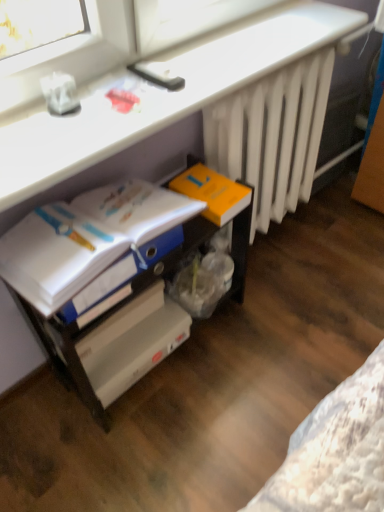
Question: Can you confirm if orange matte paperback book at center-right is shorter than blue glossy folder at lower left?

Choices:
 (A) yes
 (B) no

Answer: (A)

Question: Is orange matte paperback book at center-right behind blue glossy folder at lower left?

Choices:
 (A) yes
 (B) no

Answer: (A)

Question: Is orange matte paperback book at center-right not inside blue glossy folder at lower left?

Choices:
 (A) yes
 (B) no

Answer: (A)

Question: From the image's perspective, is orange matte paperback book at center-right above blue glossy folder at lower left?

Choices:
 (A) yes
 (B) no

Answer: (A)

Question: From the image's perspective, is orange matte paperback book at center-right beneath blue glossy folder at lower left?

Choices:
 (A) no
 (B) yes

Answer: (A)

Question: Looking at their shapes, would you say blue glossy folder at lower left is wider or thinner than white plastic computer at lower left?

Choices:
 (A) thin
 (B) wide

Answer: (A)

Question: In terms of size, does blue glossy folder at lower left appear bigger or smaller than white plastic computer at lower left?

Choices:
 (A) big
 (B) small

Answer: (B)

Question: Is blue glossy folder at lower left spatially inside white plastic computer at lower left, or outside of it?

Choices:
 (A) inside
 (B) outside

Answer: (B)

Question: From their relative heights in the image, would you say blue glossy folder at lower left is taller or shorter than white plastic computer at lower left?

Choices:
 (A) short
 (B) tall

Answer: (B)

Question: In terms of size, does white plastic computer at lower left appear bigger or smaller than blue glossy folder at lower left?

Choices:
 (A) big
 (B) small

Answer: (A)

Question: In terms of width, does white plastic computer at lower left look wider or thinner when compared to blue glossy folder at lower left?

Choices:
 (A) wide
 (B) thin

Answer: (A)

Question: Considering the relative positions of white plastic computer at lower left and blue glossy folder at lower left in the image provided, is white plastic computer at lower left to the left or to the right of blue glossy folder at lower left?

Choices:
 (A) left
 (B) right

Answer: (B)

Question: Does point (76, 155) appear closer or farther from the camera than point (129, 210)?

Choices:
 (A) farther
 (B) closer

Answer: (B)

Question: From the image's perspective, relative to orange matte paperback book at center-right, is blue glossy folder at lower left above or below?

Choices:
 (A) below
 (B) above

Answer: (A)

Question: From a real-world perspective, is blue glossy folder at lower left above or below orange matte paperback book at center-right?

Choices:
 (A) below
 (B) above

Answer: (B)